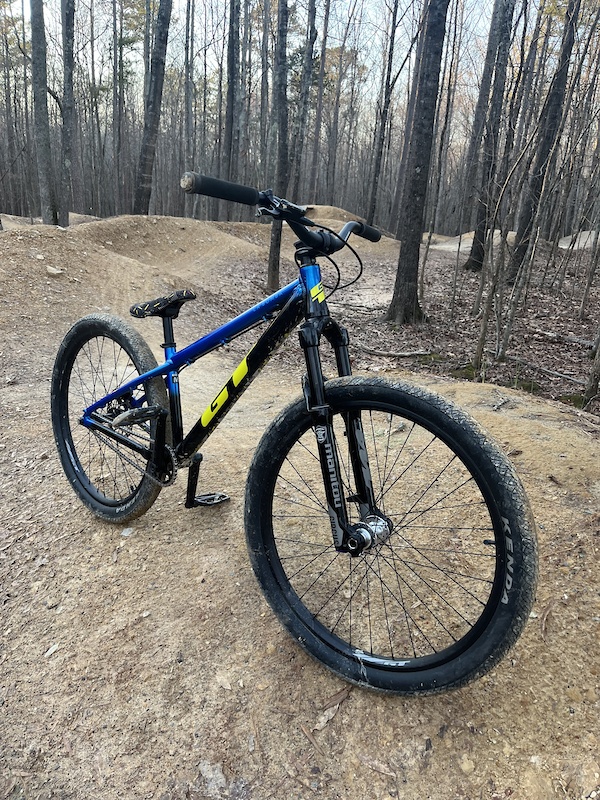
This screenshot has height=800, width=600. Find the location of `handle`. handle is located at coordinates [220, 186], [377, 230].